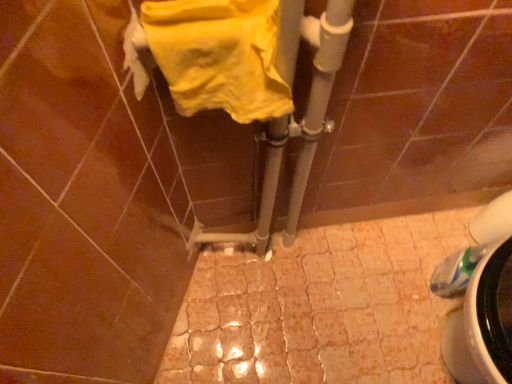
Question: Should I look upward or downward to see yellow fabric towel at upper center?

Choices:
 (A) down
 (B) up

Answer: (B)